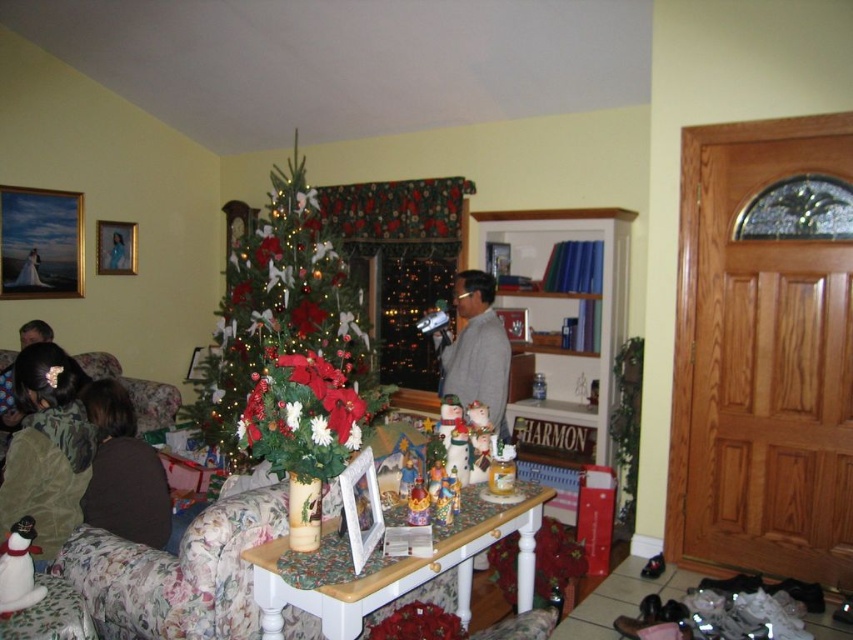
Question: Can you confirm if green matte christmas tree at center is bigger than green corduroy jacket at lower left?

Choices:
 (A) yes
 (B) no

Answer: (A)

Question: Does green matte christmas tree at center appear on the right side of green corduroy jacket at lower left?

Choices:
 (A) no
 (B) yes

Answer: (B)

Question: Which of the following is the farthest from the observer?

Choices:
 (A) [84, 486]
 (B) [335, 321]

Answer: (B)

Question: Is green matte christmas tree at center positioned in front of brown fuzzy sweater at left?

Choices:
 (A) yes
 (B) no

Answer: (B)

Question: Based on their relative distances, which object is nearer to the green corduroy jacket at lower left?

Choices:
 (A) brown fuzzy sweater at left
 (B) green matte christmas tree at center

Answer: (A)

Question: Which of the following is the closest to the observer?

Choices:
 (A) brown fuzzy sweater at left
 (B) green corduroy jacket at lower left

Answer: (B)